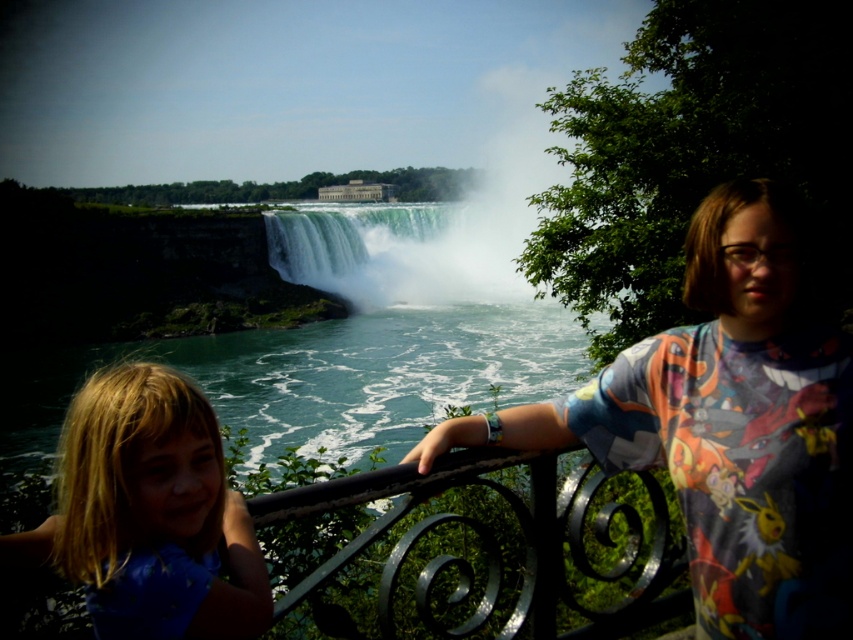
Question: Is black wrought iron at center smaller than green translucent water at center?

Choices:
 (A) yes
 (B) no

Answer: (A)

Question: Which point is closer to the camera taking this photo?

Choices:
 (A) (711, 410)
 (B) (430, 493)
 (C) (308, 234)

Answer: (B)

Question: Is multicolored fabric shirt at right closer to camera compared to blue fabric shirt at lower left?

Choices:
 (A) no
 (B) yes

Answer: (A)

Question: Can you confirm if blue fabric shirt at lower left is positioned to the left of green translucent water at center?

Choices:
 (A) no
 (B) yes

Answer: (B)

Question: Which of these objects is positioned closest to the blue fabric shirt at lower left?

Choices:
 (A) black wrought iron at center
 (B) multicolored fabric shirt at right
 (C) green translucent water at center

Answer: (A)

Question: Which point appears farthest from the camera in this image?

Choices:
 (A) (791, 474)
 (B) (343, 296)
 (C) (126, 513)
 (D) (583, 493)

Answer: (B)